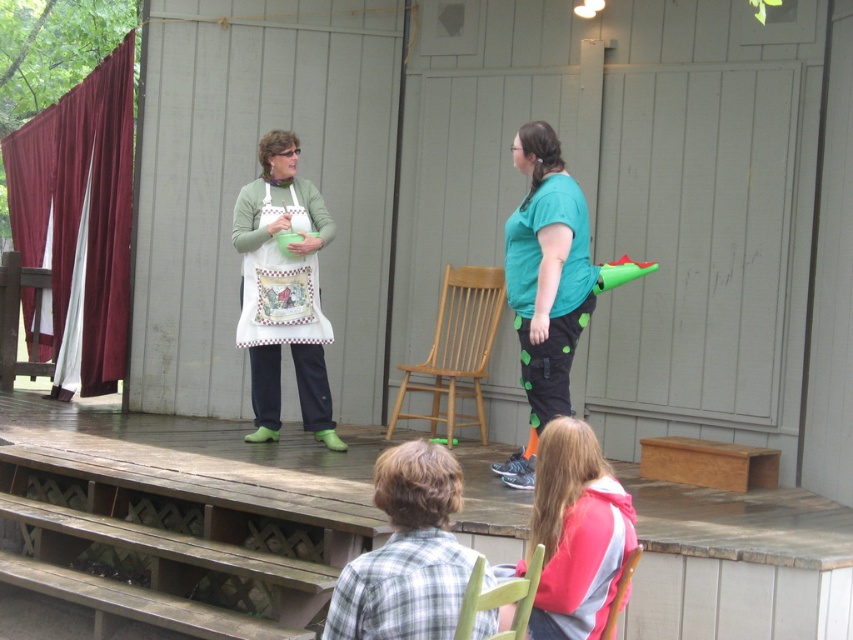
Consider the image. You are an audience member sitting in the front row of the wooden stage at center. You notice the white printed apron at center worn by the performer. Which object is closer to you?

The wooden stage at center is closer to the viewer than the white printed apron at center, so the wooden stage at center is closer to you.

You are an event planner setting up for a cooking demonstration. You have a wooden stage at center and a white printed apron at center. Which object is located to the left of the other?

The wooden stage at center is positioned on the left side of white printed apron at center, so the wooden stage at center is to the left of the white printed apron at center.

You are a photographer standing at the camera position. You want to take a closeup photo of the white apron at center. Is the apron within your camera range if your camera can focus on objects up to 7 meters away?

The white apron at center is 7.30 meters away from camera. Since the camera can focus up to 7 meters, the apron is slightly out of range. Move closer or use a different camera with longer focus range.